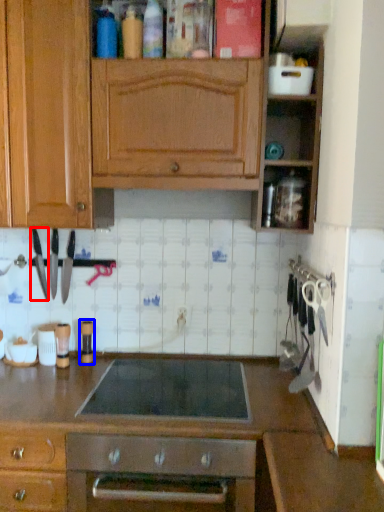
Question: Which point is further to the camera, kitchen appliance (highlighted by a red box) or appliance (highlighted by a blue box)?

Choices:
 (A) kitchen appliance
 (B) appliance

Answer: (B)